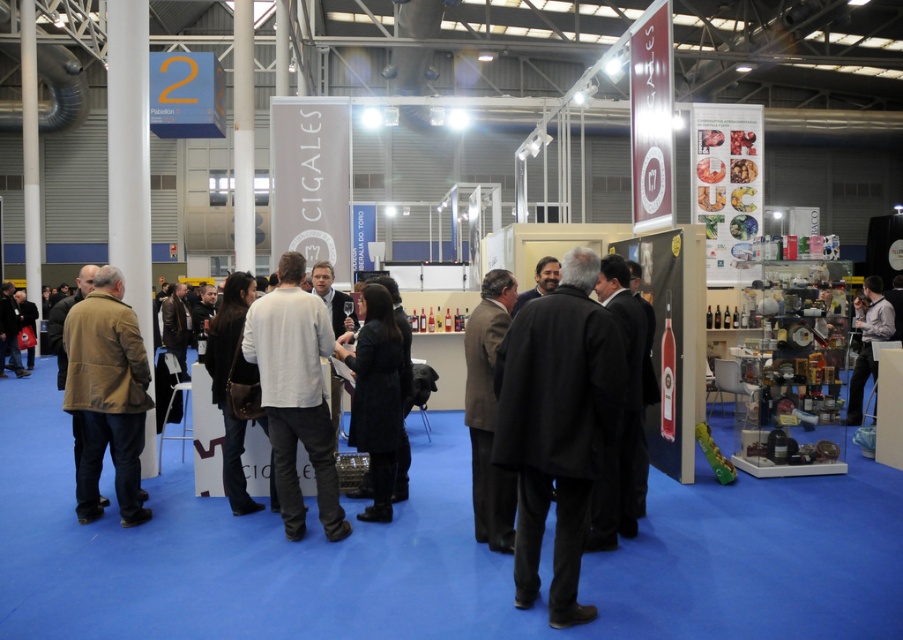
Between white cotton shirt at center and brown suede jacket at left, which one is positioned higher?

white cotton shirt at center is above.

Between point (305, 349) and point (128, 307), which one is positioned behind?

Positioned behind is point (128, 307).

Image resolution: width=903 pixels, height=640 pixels. I want to click on white cotton shirt at center, so click(295, 394).

Image resolution: width=903 pixels, height=640 pixels. In order to click on white cotton shirt at center in this screenshot , I will do `click(295, 394)`.

Does brown suede jacket at left have a larger size compared to gray fabric shirt at right?

No, brown suede jacket at left is not bigger than gray fabric shirt at right.

Does brown suede jacket at left have a lesser height compared to gray fabric shirt at right?

No, brown suede jacket at left is not shorter than gray fabric shirt at right.

The image size is (903, 640). What do you see at coordinates (107, 396) in the screenshot?
I see `brown suede jacket at left` at bounding box center [107, 396].

Where is `brown suede jacket at left`? brown suede jacket at left is located at coordinates (107, 396).

Is white cotton shirt at center positioned behind light brown wool coat at center?

Yes.

From the picture: Can you confirm if white cotton shirt at center is smaller than light brown wool coat at center?

Incorrect, white cotton shirt at center is not smaller in size than light brown wool coat at center.

Is point (296, 285) farther from viewer compared to point (497, 310)?

Yes, point (296, 285) is farther from viewer.

Identify the location of white cotton shirt at center. Image resolution: width=903 pixels, height=640 pixels. (295, 394).